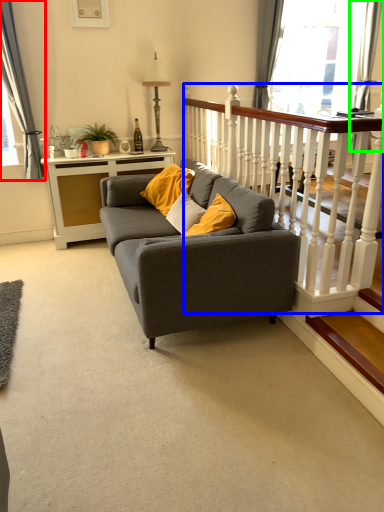
Question: Considering the real-world distances, which object is farthest from curtain (highlighted by a red box)? balustrade (highlighted by a blue box) or curtain (highlighted by a green box)?

Choices:
 (A) balustrade
 (B) curtain

Answer: (B)